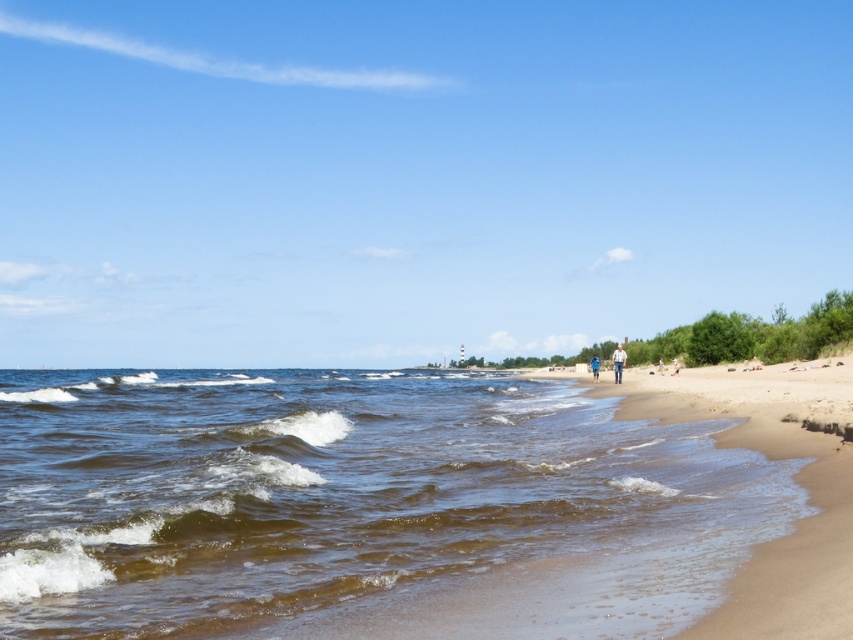
Question: Which is nearer to the brown sandy water at lower left?

Choices:
 (A) blue denim shorts at center
 (B) light brown leather jacket at center

Answer: (A)

Question: Considering the relative positions of brown sandy water at lower left and blue denim shorts at center in the image provided, where is brown sandy water at lower left located with respect to blue denim shorts at center?

Choices:
 (A) left
 (B) right

Answer: (A)

Question: Which of these objects is positioned closest to the light brown leather jacket at center?

Choices:
 (A) brown sandy water at lower left
 (B) blue denim shorts at center

Answer: (B)

Question: Considering the relative positions of light brown leather jacket at center and blue denim shorts at center in the image provided, where is light brown leather jacket at center located with respect to blue denim shorts at center?

Choices:
 (A) right
 (B) left

Answer: (A)

Question: Is brown sandy water at lower left below blue denim shorts at center?

Choices:
 (A) yes
 (B) no

Answer: (B)

Question: Which is nearer to the light brown leather jacket at center?

Choices:
 (A) blue denim shorts at center
 (B) brown sandy water at lower left

Answer: (A)